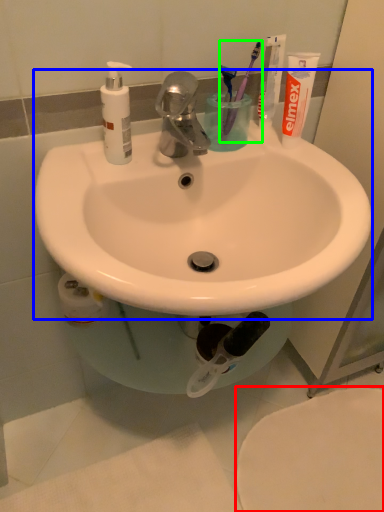
Question: Which object is positioned closest to bidet (highlighted by a red box)? Select from sink (highlighted by a blue box) and toothbrush (highlighted by a green box).

Choices:
 (A) sink
 (B) toothbrush

Answer: (A)